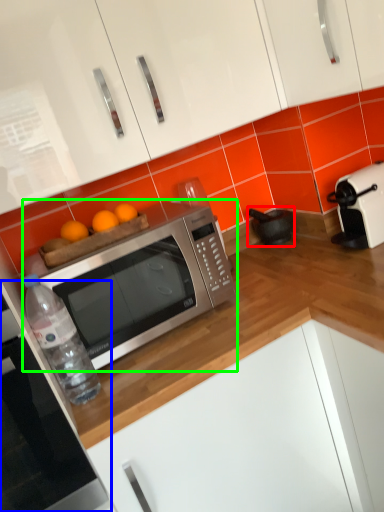
Question: Based on their relative distances, which object is nearer to appliance (highlighted by a red box)? Choose from oven (highlighted by a blue box) and microwave oven (highlighted by a green box).

Choices:
 (A) oven
 (B) microwave oven

Answer: (B)